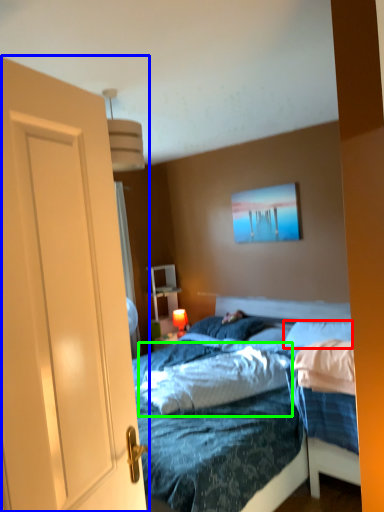
Question: Based on their relative distances, which object is farther from pillow (highlighted by a red box)? Choose from door (highlighted by a blue box) and mattress (highlighted by a green box).

Choices:
 (A) door
 (B) mattress

Answer: (A)